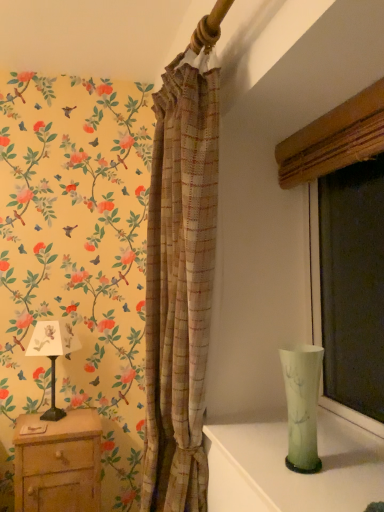
Identify the location of blank space above matte wood window frame at right (from a real-world perspective). This screenshot has height=512, width=384. (319, 113).